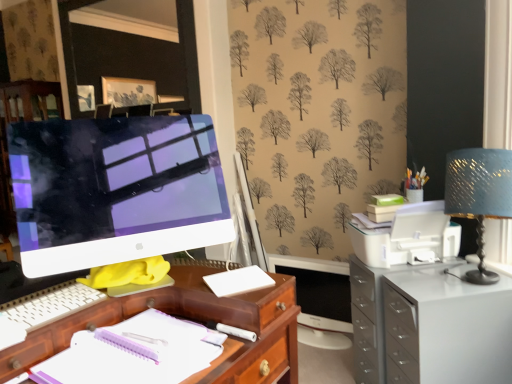
Question: In terms of height, does blue textured lampshade at upper right look taller or shorter compared to white glossy computer monitor at left?

Choices:
 (A) short
 (B) tall

Answer: (A)

Question: Is blue textured lampshade at upper right wider or thinner than white glossy computer monitor at left?

Choices:
 (A) wide
 (B) thin

Answer: (B)

Question: Which object is positioned closest to the white plastic keyboard at lower left?

Choices:
 (A) white matte cutting board at center
 (B) white glossy filing cabinet at right
 (C) white glossy computer monitor at left
 (D) white plastic printer at right
 (E) white paper notebook at center

Answer: (E)

Question: Which is nearer to the white plastic keyboard at lower left?

Choices:
 (A) white glossy computer monitor at left
 (B) white glossy computer monitor at left
 (C) white plastic printer at right
 (D) white glossy filing cabinet at right
 (E) blue textured lampshade at upper right

Answer: (A)